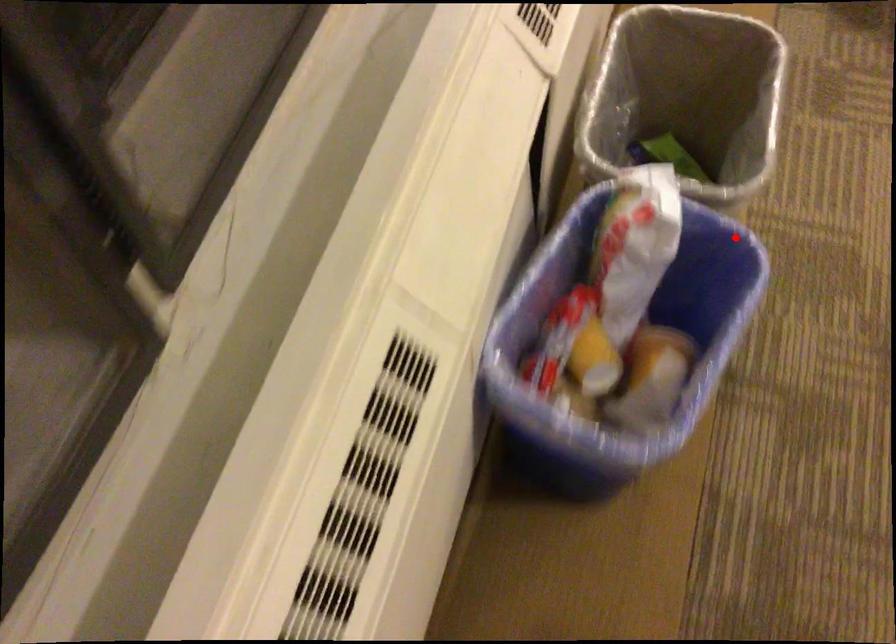
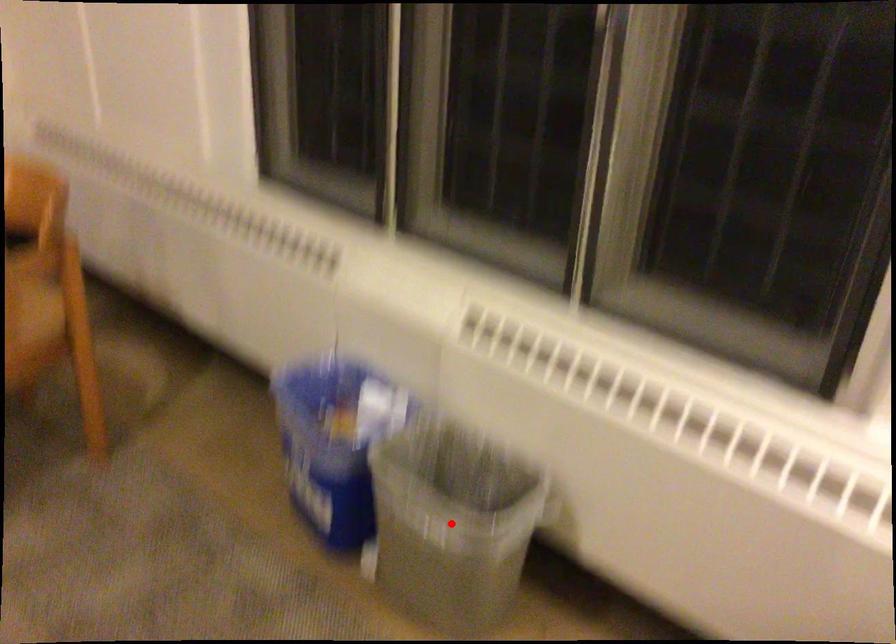
I am providing you with two images of the same scene from different viewpoints. A red point is marked on the first image and another point is marked on the second image. Are the points marked in image1 and image2 representing the same 3D position?

No